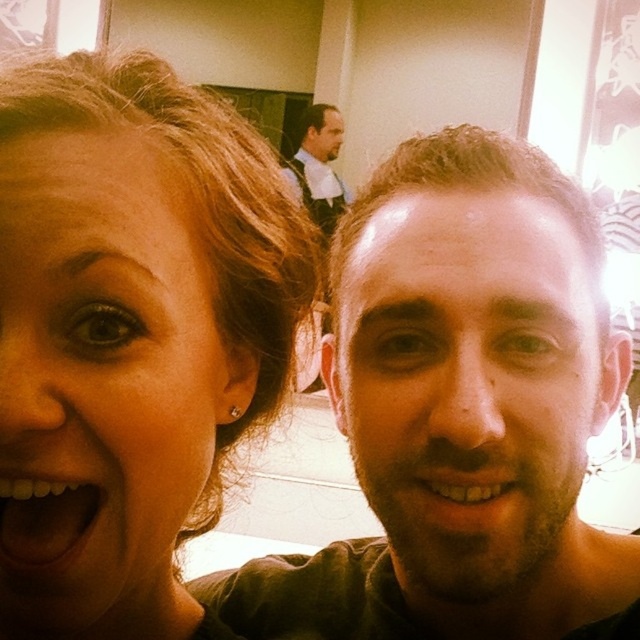
Question: Can you confirm if matte skin at center is thinner than matte black face at upper center?

Choices:
 (A) yes
 (B) no

Answer: (A)

Question: Which point appears farthest from the camera in this image?

Choices:
 (A) (330, 161)
 (B) (154, 492)
 (C) (428, 563)

Answer: (A)

Question: Is brown matte face at center below matte skin at center?

Choices:
 (A) yes
 (B) no

Answer: (B)

Question: Is brown matte face at center further to camera compared to white glossy teeth at lower left?

Choices:
 (A) no
 (B) yes

Answer: (B)

Question: Which object appears farthest from the camera in this image?

Choices:
 (A) matte black face at upper center
 (B) brown matte face at center
 (C) matte skin at center
 (D) brown matte hair at center

Answer: (A)

Question: Which of the following is the closest to the observer?

Choices:
 (A) matte skin at center
 (B) brown matte hair at center

Answer: (B)